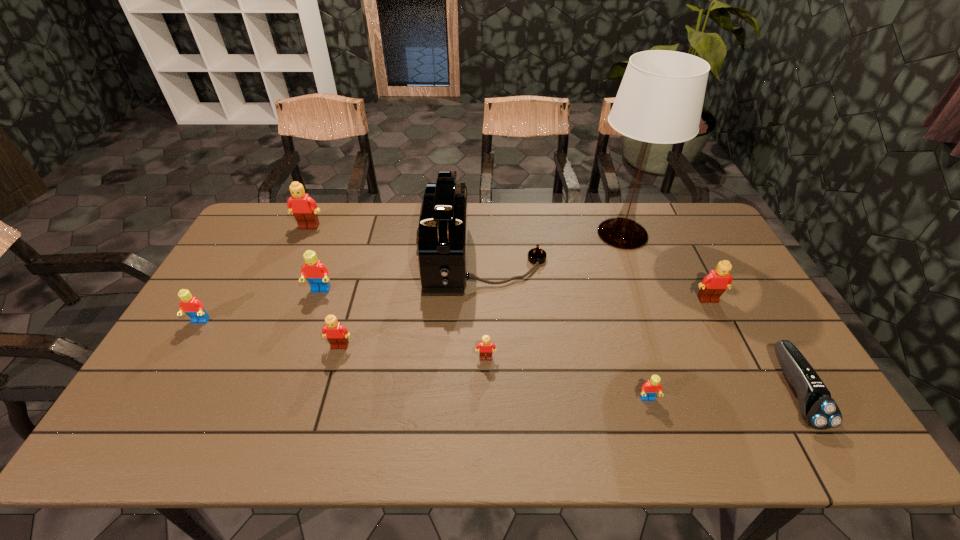
Find the location of a particular element. This screenshot has height=540, width=960. Lego that is at the far edge is located at coordinates 304,208.

This screenshot has height=540, width=960. I want to click on object at the near edge, so click(x=818, y=408).

Find the location of a particular element. Lego positioned at the right edge is located at coordinates (713, 285).

Locate an element on the screen. electric shaver present at the right edge is located at coordinates (818, 408).

Find the location of a particular element. object that is at the far left corner is located at coordinates 304,208.

I want to click on object located at the near right corner, so click(818, 408).

What are the coordinates of `vacant space at the far edge` in the screenshot? It's located at (587, 205).

Find the location of a particular element. The width and height of the screenshot is (960, 540). vacant space at the near edge of the desktop is located at coordinates (513, 426).

Locate an element on the screen. The width and height of the screenshot is (960, 540). free location at the left edge is located at coordinates (x=227, y=302).

The height and width of the screenshot is (540, 960). I want to click on free space at the near left corner of the desktop, so click(124, 433).